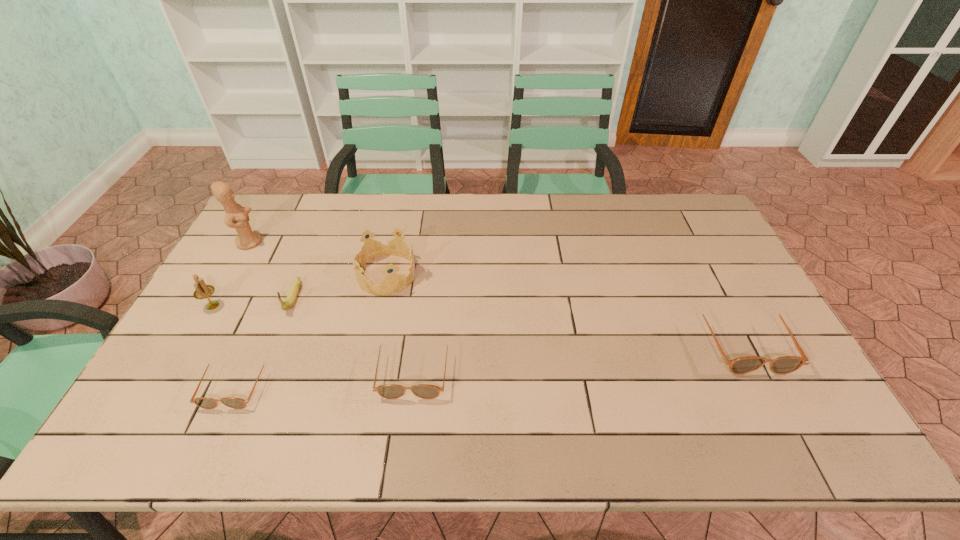
What are the coordinates of `unoccupied position between the shortest object and the second sunglasses from right to left` in the screenshot? It's located at (324, 376).

Where is `free spot between the tiara and the candle holder`? The image size is (960, 540). free spot between the tiara and the candle holder is located at coordinates (300, 290).

What are the coordinates of `vacant space that is in between the candle holder and the figurine` in the screenshot? It's located at (231, 274).

At what (x,y) coordinates should I click in order to perform the action: click on empty space between the tiara and the banana. Please return your answer as a coordinate pair (x, y). Looking at the image, I should click on (x=340, y=286).

The width and height of the screenshot is (960, 540). I want to click on vacant area that lies between the candle holder and the shortest sunglasses, so click(224, 345).

This screenshot has width=960, height=540. I want to click on free point between the second sunglasses from left to right and the shortest object, so click(x=324, y=376).

Identify the location of empty space that is in between the rightmost sunglasses and the figurine. The width and height of the screenshot is (960, 540). (496, 292).

The height and width of the screenshot is (540, 960). Identify the location of vacant point located between the farthest object and the second tallest sunglasses. (332, 306).

I want to click on free area in between the banana and the rightmost sunglasses, so click(x=518, y=320).

At what (x,y) coordinates should I click in order to perform the action: click on free spot between the banana and the figurine. Please return your answer as a coordinate pair (x, y). This screenshot has width=960, height=540. Looking at the image, I should click on (272, 270).